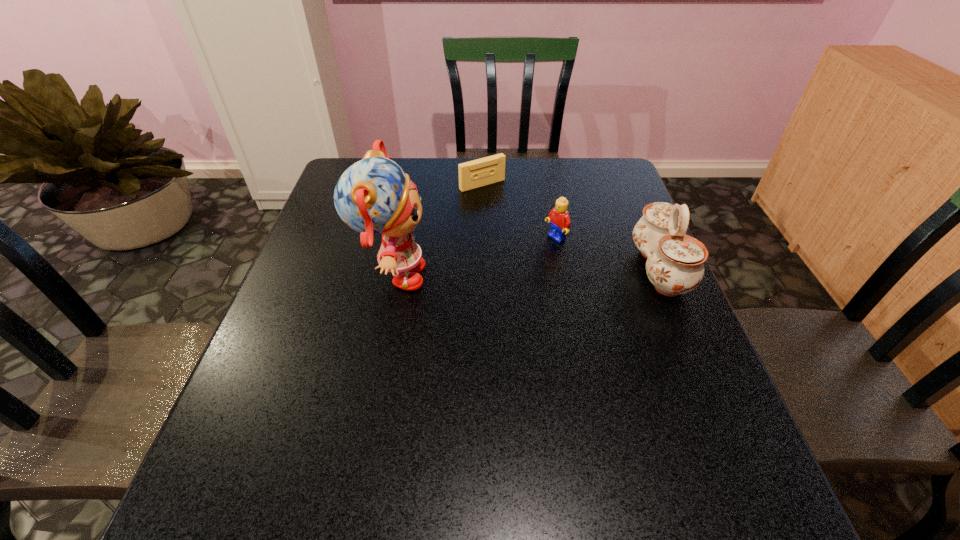
Where is `doll`? This screenshot has height=540, width=960. doll is located at coordinates (373, 196).

Locate an element on the screen. The width and height of the screenshot is (960, 540). the leftmost object is located at coordinates 373,196.

Identify the location of chinaware. pos(675,261).

Where is `the third shortest object`? the third shortest object is located at coordinates (675, 261).

Image resolution: width=960 pixels, height=540 pixels. What are the coordinates of `Lego` in the screenshot? It's located at (559, 219).

Locate an element on the screen. the third tallest object is located at coordinates (559, 219).

Where is `videotape`? This screenshot has height=540, width=960. videotape is located at coordinates (488, 170).

Where is `the shortest object`? the shortest object is located at coordinates (488, 170).

You are a GUI agent. You are given a task and a screenshot of the screen. Output one action in this format:
    pyautogui.click(x=<x>, y=<y>)
    Task: Click on the free region located 0.360m on the face of the doll
    The width and height of the screenshot is (960, 540).
    Given the screenshot: What is the action you would take?
    pyautogui.click(x=577, y=278)

Identify the location of blank area located 0.330m by the handle of the third shortest object. Image resolution: width=960 pixels, height=540 pixels. (501, 269).